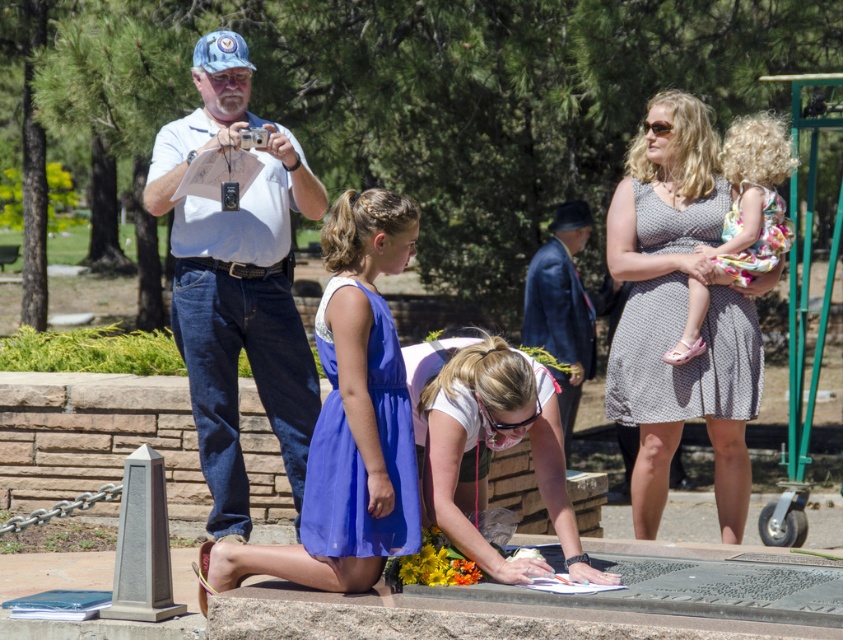
You are a photographer trying to capture a photo of both the polka dot dress at upper right and the gray dotted dress at center. Given that your camera has a maximum focus range of 2 inches, will you be able to fit both subjects within the frame without moving the camera?

The polka dot dress at upper right and gray dotted dress at center are 2.34 inches apart from each other, which exceeds the camera maximum focus range of 2 inches. Therefore, you cannot fit both subjects within the frame without moving the camera.

You are organizing a photo shoot and need to arrange the blue satin dress at center and the gray dotted dress at center in a way that highlights their size difference. Based on their sizes, which dress should be placed closer to the camera to create a visual emphasis on their relative sizes?

The blue satin dress at center is bigger than the gray dotted dress at center. To emphasize their size difference, the smaller gray dotted dress at center should be placed closer to the camera, making it appear larger in comparison, while the larger blue satin dress at center can be positioned farther back to maintain its dominance in size.